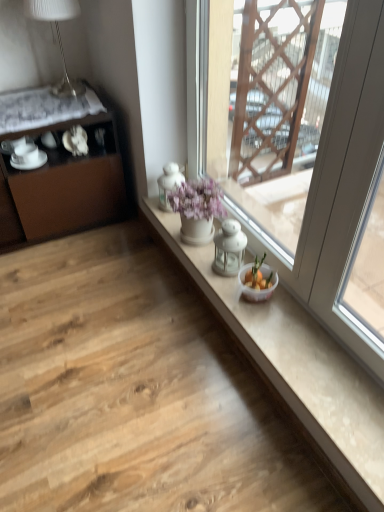
At what (x,y) coordinates should I click in order to perform the action: click on vacant area situated below white glossy table lamp at upper left (from a real-world perspective). Please return your answer as a coordinate pair (x, y). Looking at the image, I should click on (65, 92).